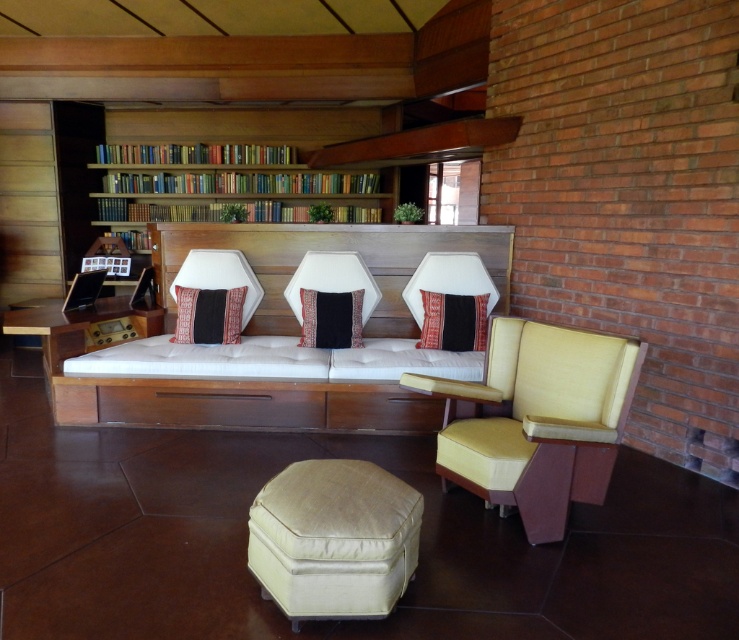
From the picture: Which of these two, beige fabric ottoman at center or wooden bookshelf at upper center, stands shorter?

Standing shorter between the two is beige fabric ottoman at center.

Does beige fabric ottoman at center appear on the right side of wooden bookshelf at upper center?

Yes, beige fabric ottoman at center is to the right of wooden bookshelf at upper center.

Which is behind, point (321, 605) or point (287, 204)?

Point (287, 204)

The height and width of the screenshot is (640, 739). I want to click on beige fabric ottoman at center, so click(x=333, y=540).

Between white fabric couch at center and black fabric pillow at center, which one has more height?

Standing taller between the two is white fabric couch at center.

Between point (95, 419) and point (316, 339), which one is positioned behind?

Point (316, 339)

Who is more forward, (211,396) or (353,339)?

Point (211,396) is more forward.

The width and height of the screenshot is (739, 640). Identify the location of white fabric couch at center. (239, 401).

Who is higher up, white fabric couch at center or textured red pillow at center?

white fabric couch at center is above.

Does white fabric couch at center have a larger size compared to textured red pillow at center?

Yes.

Does point (330, 410) come behind point (197, 321)?

That is False.

Where is `white fabric couch at center`? The height and width of the screenshot is (640, 739). white fabric couch at center is located at coordinates (239, 401).